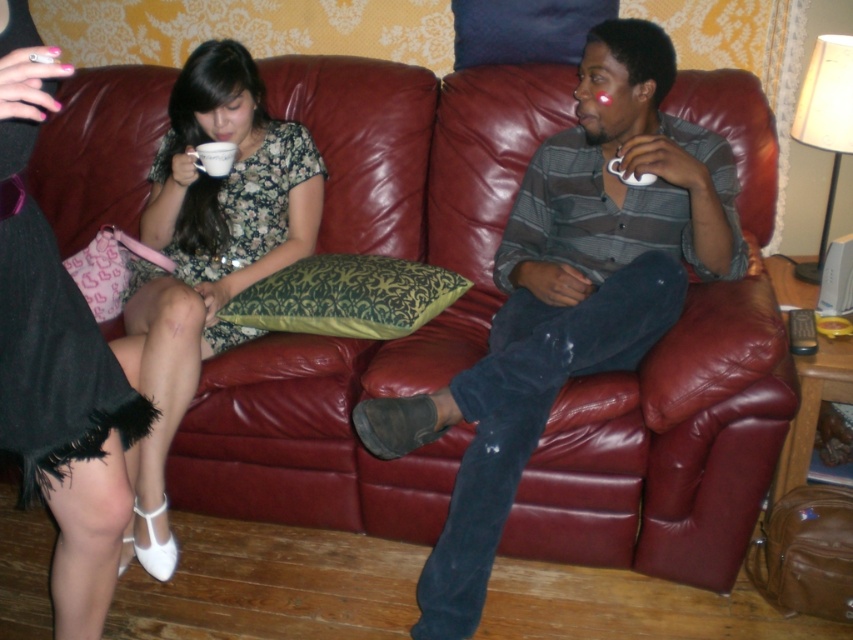
Does point (192, 394) come closer to viewer compared to point (103, 545)?

That is False.

Who is positioned more to the right, floral dress at left or matte floral dress at center?

floral dress at left

Describe the element at coordinates (207, 252) in the screenshot. This screenshot has height=640, width=853. I see `floral dress at left` at that location.

Image resolution: width=853 pixels, height=640 pixels. Identify the location of floral dress at left. (207, 252).

Between point (717, 234) and point (109, 419), which one is positioned behind?

Positioned behind is point (717, 234).

Does matte striped shirt at center lie in front of matte floral dress at center?

No, it is behind matte floral dress at center.

The height and width of the screenshot is (640, 853). What are the coordinates of `matte striped shirt at center` in the screenshot? It's located at (567, 294).

Does matte floral dress at center have a lesser width compared to matte ceramic cup at upper left?

No, matte floral dress at center is not thinner than matte ceramic cup at upper left.

Can you confirm if matte floral dress at center is taller than matte ceramic cup at upper left?

Yes, matte floral dress at center is taller than matte ceramic cup at upper left.

Which is in front, point (48, 486) or point (219, 141)?

Point (48, 486)

Locate an element on the screen. The width and height of the screenshot is (853, 640). matte floral dress at center is located at coordinates (56, 360).